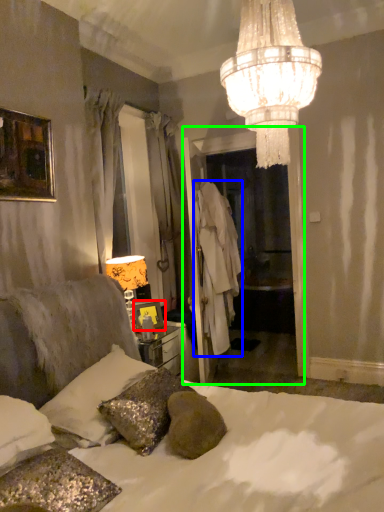
Question: Which is farther away from picture frame (highlighted by a red box)? robe (highlighted by a blue box) or glass door (highlighted by a green box)?

Choices:
 (A) robe
 (B) glass door

Answer: (A)